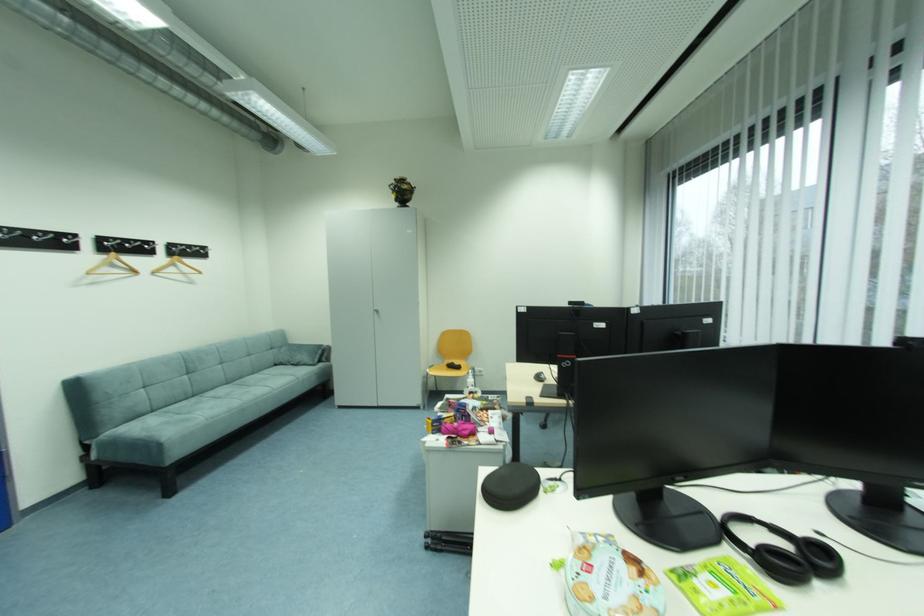
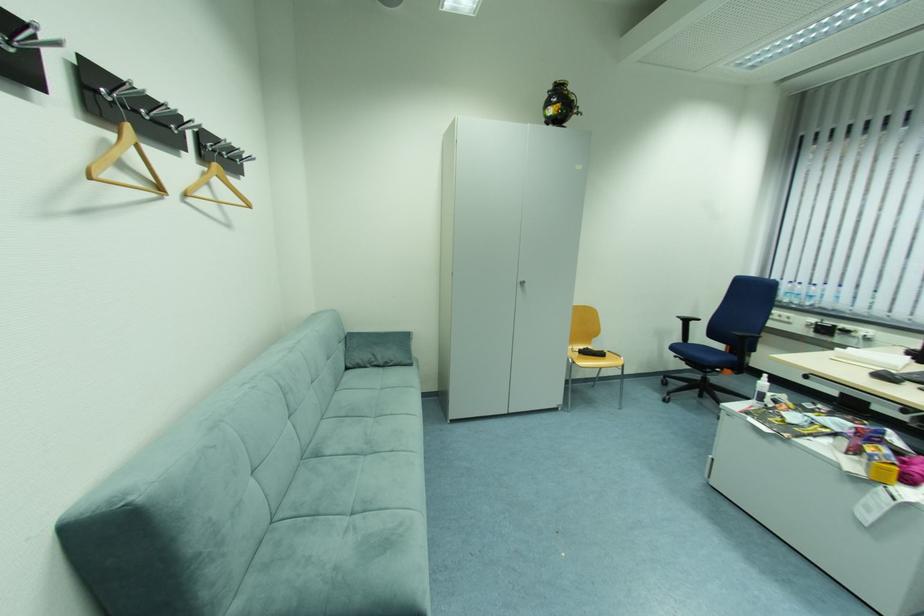
Where in the second image is the point corresponding to (x=283, y=367) from the first image?

(354, 370)